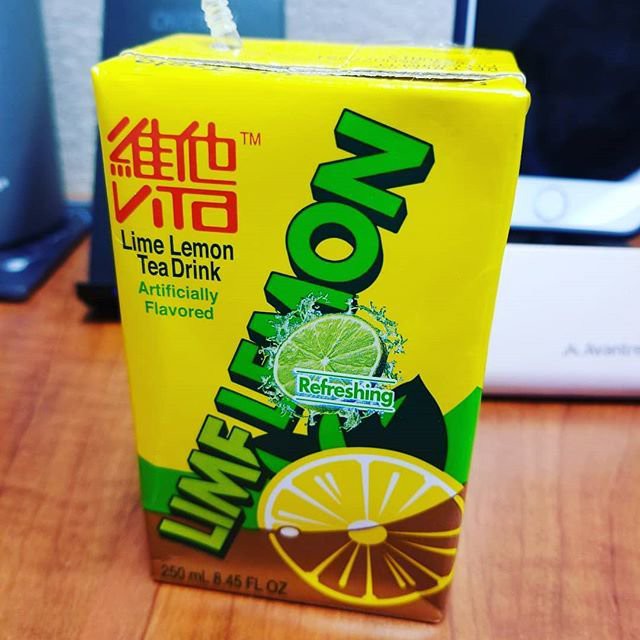
What are the coordinates of `light brown table surface` in the screenshot? It's located at (33, 479), (578, 516).